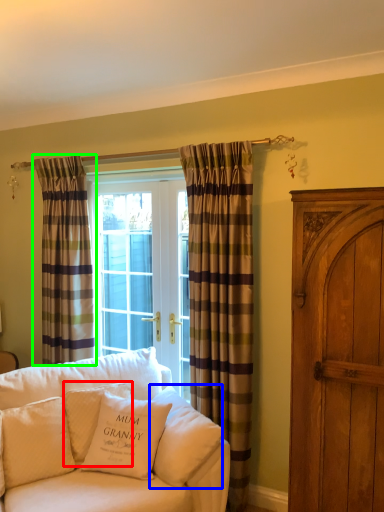
Question: Which object is positioned farthest from pillow (highlighted by a red box)? Select from pillow (highlighted by a blue box) and curtain (highlighted by a green box).

Choices:
 (A) pillow
 (B) curtain

Answer: (B)